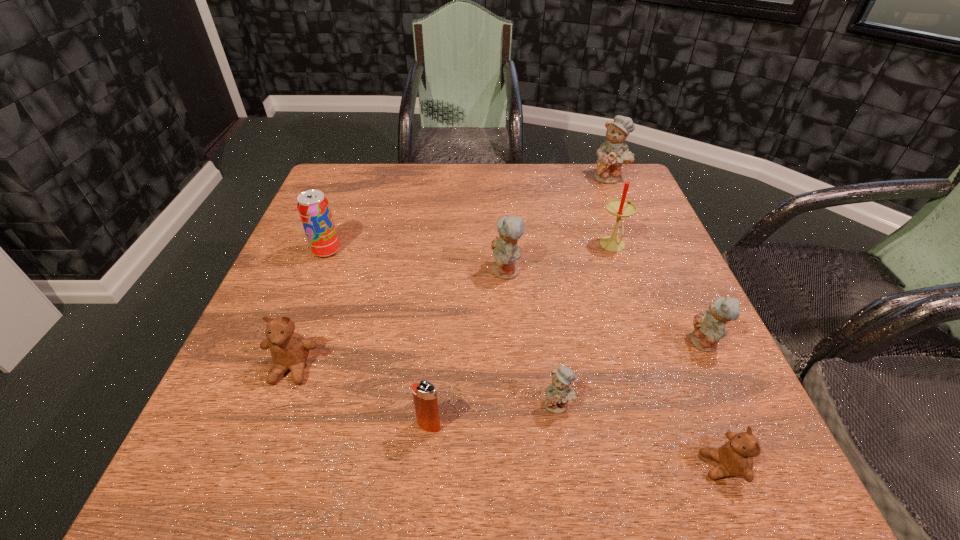
Find the location of `object that is positioned at the far edge`. object that is positioned at the far edge is located at coordinates (611, 155).

Locate an element on the screen. Image resolution: width=960 pixels, height=540 pixels. object situated at the near edge is located at coordinates pos(735,458).

Locate an element on the screen. The width and height of the screenshot is (960, 540). soda can that is at the left edge is located at coordinates (313, 207).

At what (x,y) coordinates should I click in order to perform the action: click on teddy bear located in the left edge section of the desktop. Please return your answer as a coordinate pair (x, y). Looking at the image, I should click on (289, 350).

Identify the location of candle at the right edge. (620, 208).

This screenshot has height=540, width=960. I want to click on object that is at the far right corner, so click(611, 155).

Locate an element on the screen. object present at the near right corner is located at coordinates (735, 458).

Where is `blank space at the far edge of the desktop`? The height and width of the screenshot is (540, 960). blank space at the far edge of the desktop is located at coordinates (429, 180).

This screenshot has width=960, height=540. Find the location of `blank space at the near edge of the desktop`. blank space at the near edge of the desktop is located at coordinates (465, 470).

In order to click on vacant area at the left edge in this screenshot , I will do `click(318, 319)`.